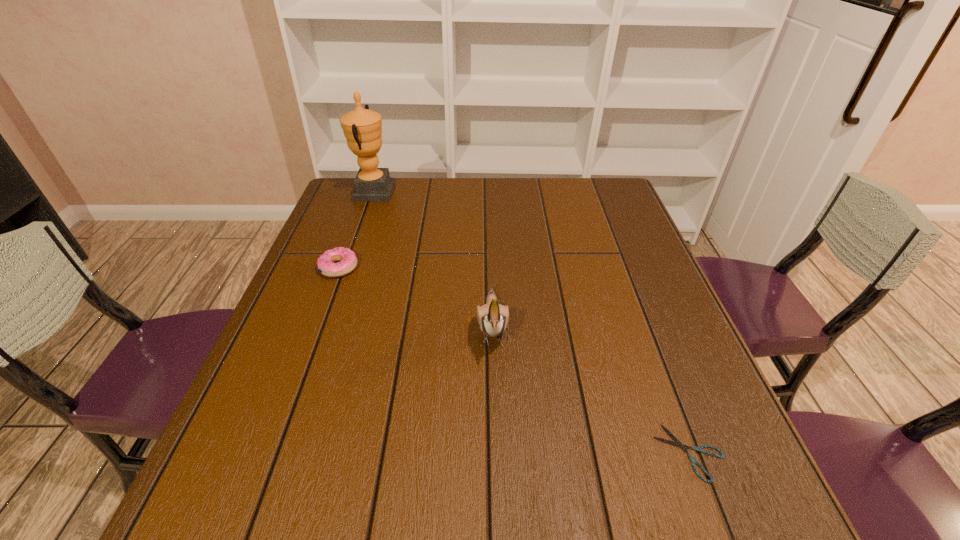
What are the coordinates of `blank space at the near edge` in the screenshot? It's located at (471, 514).

The image size is (960, 540). What are the coordinates of `vacant space at the left edge` in the screenshot? It's located at (366, 245).

The height and width of the screenshot is (540, 960). I want to click on free space at the right edge of the desktop, so click(x=631, y=325).

Find the location of a particular element. blank area at the far right corner is located at coordinates (579, 179).

Where is `vacant space at the near right corner of the desktop`? vacant space at the near right corner of the desktop is located at coordinates (684, 484).

You are a GUI agent. You are given a task and a screenshot of the screen. Output one action in this format:
    pyautogui.click(x=<x>, y=<y>)
    Task: Click on the free space between the tallest object and the bird
    This screenshot has height=540, width=960.
    Given the screenshot: What is the action you would take?
    (433, 260)

Find the location of `free spot between the third farthest object and the farthest object`. free spot between the third farthest object and the farthest object is located at coordinates (433, 260).

You are a GUI agent. You are given a task and a screenshot of the screen. Output one action in this format:
    pyautogui.click(x=<x>, y=<y>)
    Task: Click on the free space between the rightmost object and the second farthest object
    This screenshot has height=540, width=960.
    Given the screenshot: What is the action you would take?
    tap(515, 360)

Find the location of `vacant space in between the tallest object and the shortest object`. vacant space in between the tallest object and the shortest object is located at coordinates (532, 322).

I want to click on empty space that is in between the third object from left to right and the shears, so click(591, 389).